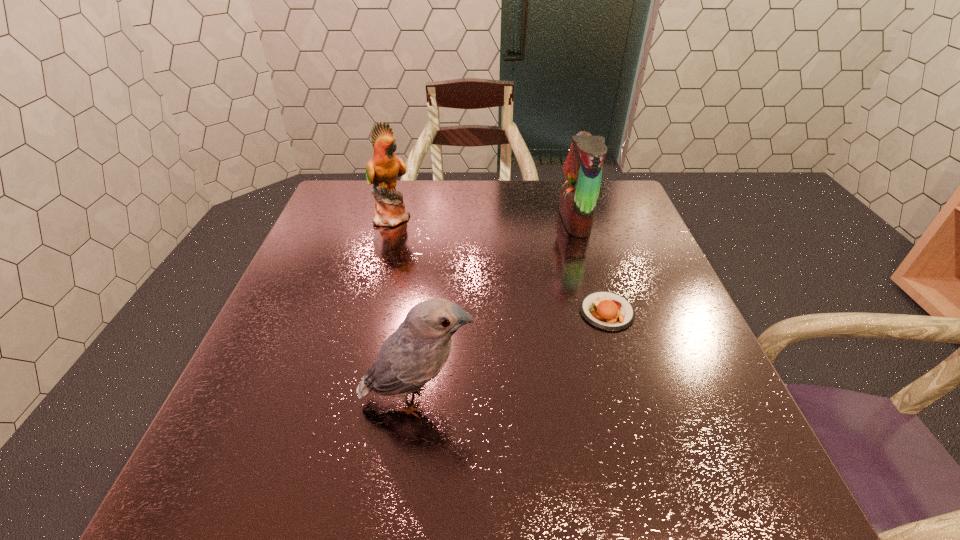
Identify the location of vacant area at the far right corner. (621, 218).

What are the coordinates of `free spot between the nearest object and the rightmost parrot` in the screenshot? It's located at (496, 310).

The height and width of the screenshot is (540, 960). Identify the location of empty location between the rightmost parrot and the nearest parrot. (496, 310).

Identify the location of vacant space that's between the shortest object and the rightmost parrot. (590, 266).

Locate which object is the third closest to the nearest object. Please provide its 2D coordinates. Your answer should be formatted as a tuple, i.e. [(x, y)], where the tuple contains the x and y coordinates of a point satisfying the conditions above.

[(583, 168)]

Identify which object is located as the nearest to the rightmost parrot. Please provide its 2D coordinates. Your answer should be formatted as a tuple, i.e. [(x, y)], where the tuple contains the x and y coordinates of a point satisfying the conditions above.

[(605, 310)]

You are a GUI agent. You are given a task and a screenshot of the screen. Output one action in this format:
    pyautogui.click(x=<x>, y=<y>)
    Task: Click on the parrot that stands as the second closest to the rightmost parrot
    This screenshot has width=960, height=540.
    Given the screenshot: What is the action you would take?
    pyautogui.click(x=415, y=353)

Point out which parrot is positioned as the third nearest to the shortest object. Please provide its 2D coordinates. Your answer should be formatted as a tuple, i.e. [(x, y)], where the tuple contains the x and y coordinates of a point satisfying the conditions above.

[(382, 170)]

This screenshot has height=540, width=960. Find the location of `free spot that satisfies the following two spatial constraints: 1. at the face of the rightmost parrot; 2. on the right side of the shortest object`. free spot that satisfies the following two spatial constraints: 1. at the face of the rightmost parrot; 2. on the right side of the shortest object is located at coordinates (601, 312).

Locate an element on the screen. The width and height of the screenshot is (960, 540). free space that satisfies the following two spatial constraints: 1. at the face of the rightmost parrot; 2. on the left side of the patty (food) is located at coordinates (601, 312).